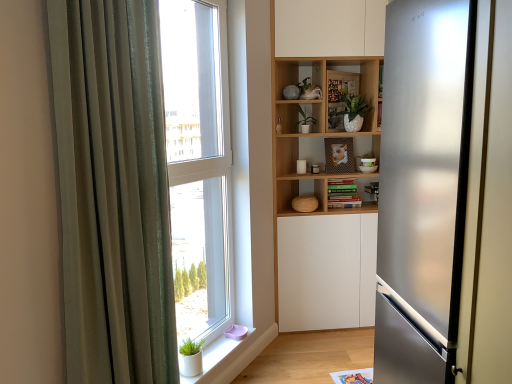
Question: From a real-world perspective, is satin silver refrigerator at right above or below wooden bookshelf at center?

Choices:
 (A) above
 (B) below

Answer: (B)

Question: Is satin silver refrigerator at right in front of or behind wooden bookshelf at center in the image?

Choices:
 (A) behind
 (B) front

Answer: (B)

Question: Which object is positioned closest to the satin silver refrigerator at right?

Choices:
 (A) wooden bookshelf at center
 (B) white matte window sill at lower left
 (C) green sheer curtain at left
 (D) transparent glass window at center
 (E) green matte plant at center, the second plant in the right-to-left sequence

Answer: (A)

Question: Considering the real-world distances, which object is closest to the green sheer curtain at left?

Choices:
 (A) transparent glass window at center
 (B) green matte plant at center, which is the first plant from left to right
 (C) green matte plant at upper center, the 1th plant from the right
 (D) satin silver refrigerator at right
 (E) white matte window sill at lower left

Answer: (A)